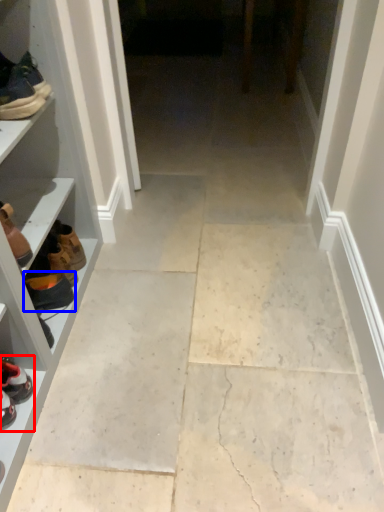
Question: Which of the following is the farthest to the observer, footwear (highlighted by a red box) or footwear (highlighted by a blue box)?

Choices:
 (A) footwear
 (B) footwear

Answer: (B)